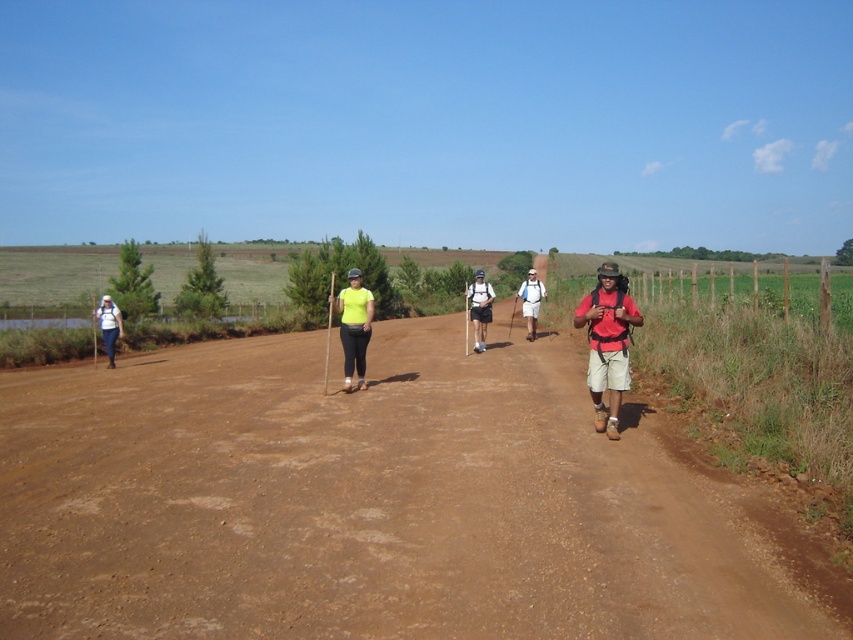
You are a photographer trying to capture a group photo of the matte red shirt at center and the matte black backpack at center. Since you want to ensure both are clearly visible, which object should you focus on first to avoid blurriness?

The matte red shirt at center has a smaller size compared to matte black backpack at center, so focusing on the smaller matte red shirt at center first will help ensure clarity before adjusting for the larger matte black backpack at center.

You are standing at the point marked by the coordinates point [364,339] while hiking on a dirt path surrounded by grassy areas and a distant body of water. A friend is approaching from behind you. If your friend is currently 20 feet away from you, will they be able to see the small body of water in the background once they reach your current position?

The point [364,339] is 37.81 feet away from the viewer. Since your friend is 20 feet behind you, when they reach your current position, they will be at the point [364,339] which is 37.81 feet from the viewer. Therefore, they will be able to see the small body of water in the background as it is part of the scene described in the image.

You are a drone operator tasked with capturing aerial footage of the hiking group. Your drone has a maximum operational range of 10 meters. If you are positioned at the matte red shirt at center, can you safely control the drone to film the matte black backpack at center without exceeding the drone range?

The distance between the matte red shirt at center and the matte black backpack at center is 10.56 meters. Since the drone has a 10 meter range, it cannot safely film the matte black backpack at center without exceeding its operational limit.